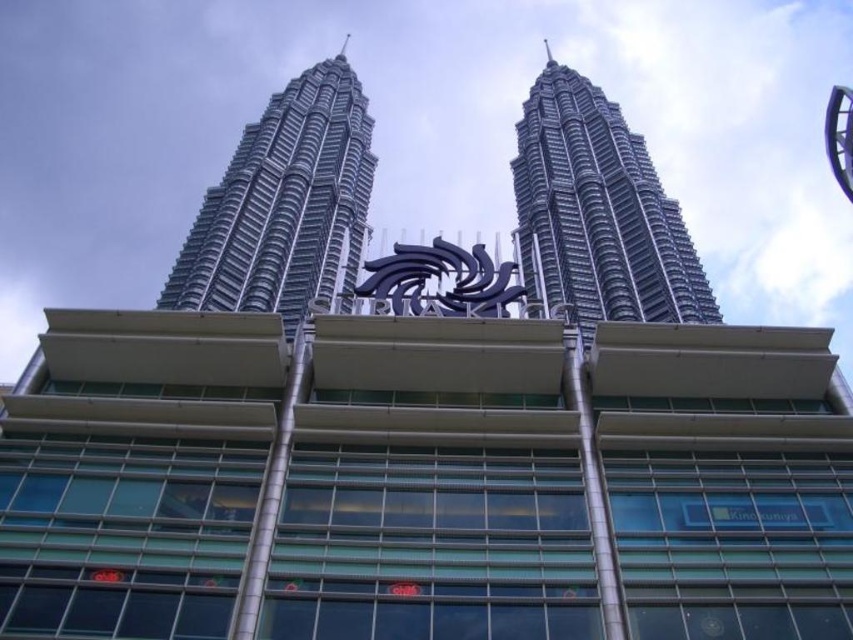
You are a drone operator tasked with capturing aerial footage of the Petronas Twin Towers. You notice two silver metallic structures in your camera viewfinder. The first is the silver metallic skyscraper at upper left, and the second is the silver metallic tower at center. Your mission requires you to prioritize filming the taller structure first. Which structure should you film first?

The silver metallic skyscraper at upper left is taller than the silver metallic tower at center, so you should film the silver metallic skyscraper at upper left first.

You are a tourist standing in front of the modern glass building with the logo. You want to take a photo that includes both the silver metallic skyscraper at upper left and the silver metallic tower at center. Which direction should you move to ensure both are in the frame?

You should move to the right so that both the silver metallic skyscraper at upper left and the silver metallic tower at center are visible in the frame since the silver metallic skyscraper at upper left is to the left of the silver metallic tower at center.

You are a drone operator planning to fly a drone from the silver metallic skyscraper at upper left to the silver metallic tower at center. Considering their positions, will the drone have an unobstructed path? Explain your reasoning based on their spatial relationship.

The silver metallic skyscraper at upper left is in front of the silver metallic tower at center, meaning the drone would need to navigate around or over the skyscraper to reach the tower, so the path is not completely unobstructed.